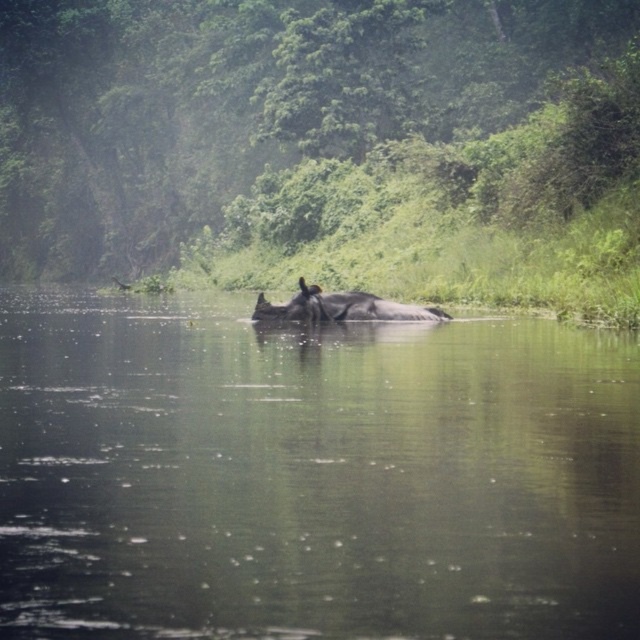
You are a wildlife photographer aiming to capture a clear shot of the rhinoceros in the water. You are positioned on the bank where the green leafy vegetation at center is located. The greenish murky water at center is between you and the rhino. Can you see the rhino clearly through the water? Explain your reasoning.

The greenish murky water at center is 25.02 meters away from the green leafy vegetation at center. Since the water is murky, visibility through 25 meters of murky water would likely be poor, making it difficult to see the rhino clearly.

You are a wildlife photographer aiming to capture a clear shot of the gray matte rhinoceros at center without any obstruction. Given the green leafy vegetation at center, will the vegetation block your view of the rhinoceros?

The green leafy vegetation at center has a greater height compared to the gray matte rhinoceros at center, so the vegetation will block your view of the rhinoceros.